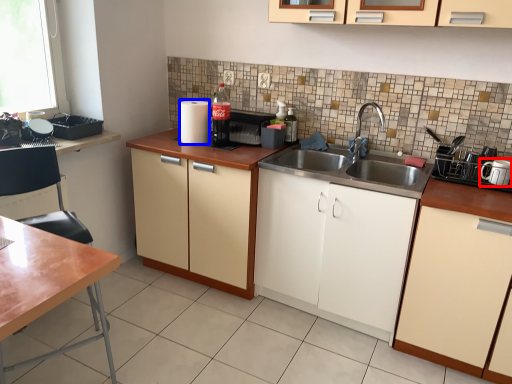
Question: Among these objects, which one is nearest to the camera, appliance (highlighted by a red box) or appliance (highlighted by a blue box)?

Choices:
 (A) appliance
 (B) appliance

Answer: (A)